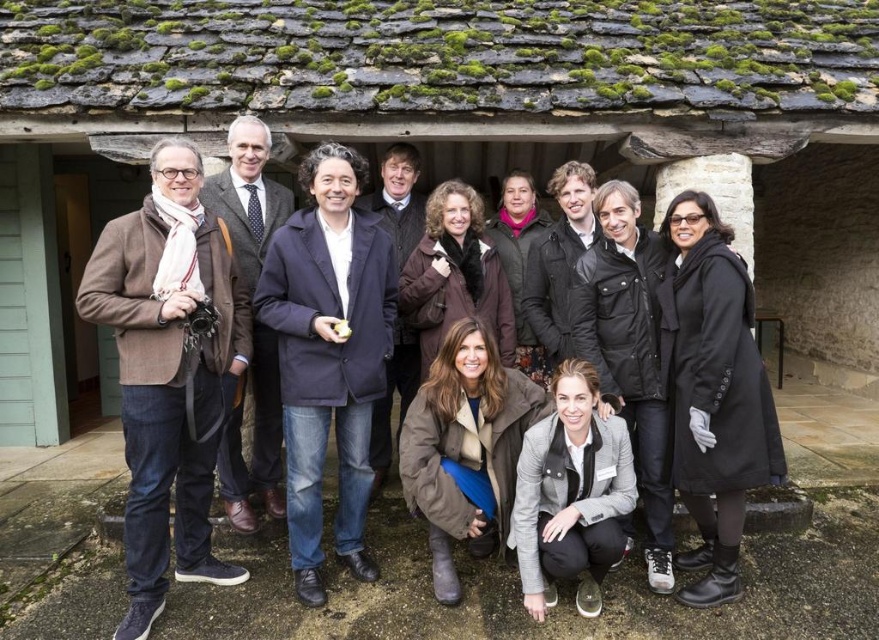
You are a photographer trying to capture the group photo. You notice the brown woolen jacket at left and the dark brown leather jacket at center. Which jacket is blocking the view to the other?

The brown woolen jacket at left is in front of the dark brown leather jacket at center, so it is blocking the view to the dark brown leather jacket at center.

You are a photographer standing 3 meters away from the brown woolen jacket at left. You want to take a photo of the dark brown leather jacket at center without moving your position. Can you capture both jackets in the same frame?

The distance between the brown woolen jacket at left and the dark brown leather jacket at center is 2.18 meters. Since you are 3 meters away from the brown woolen jacket at left, the dark brown leather jacket at center is within your camera frame, so yes, you can capture both jackets in the same frame.